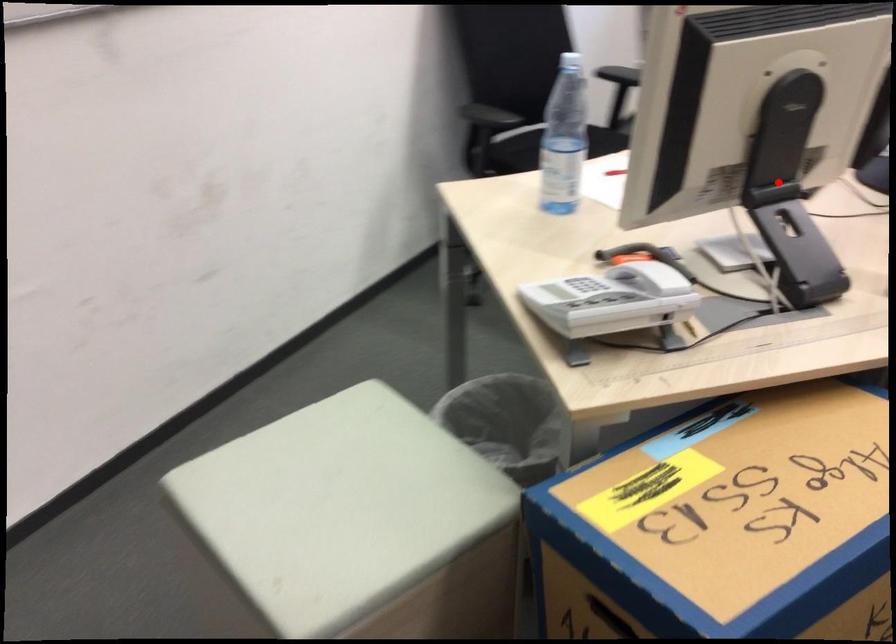
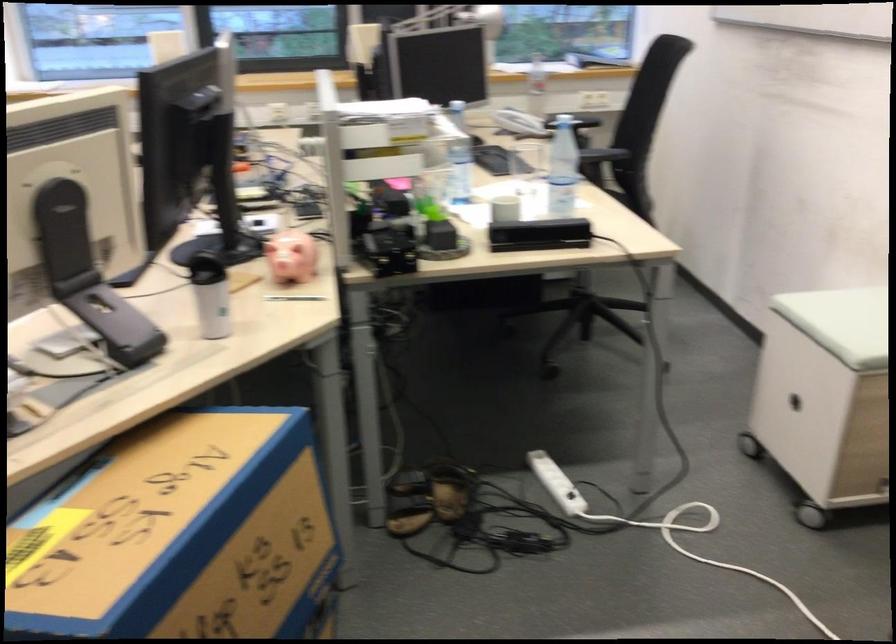
Question: I am providing you with two images of the same scene from different viewpoints. Image1 has a red point marked. In image2, the corresponding 3D location appears at what relative position? Reply with the corresponding letter.

Choices:
 (A) Closer
 (B) Farther

Answer: (B)